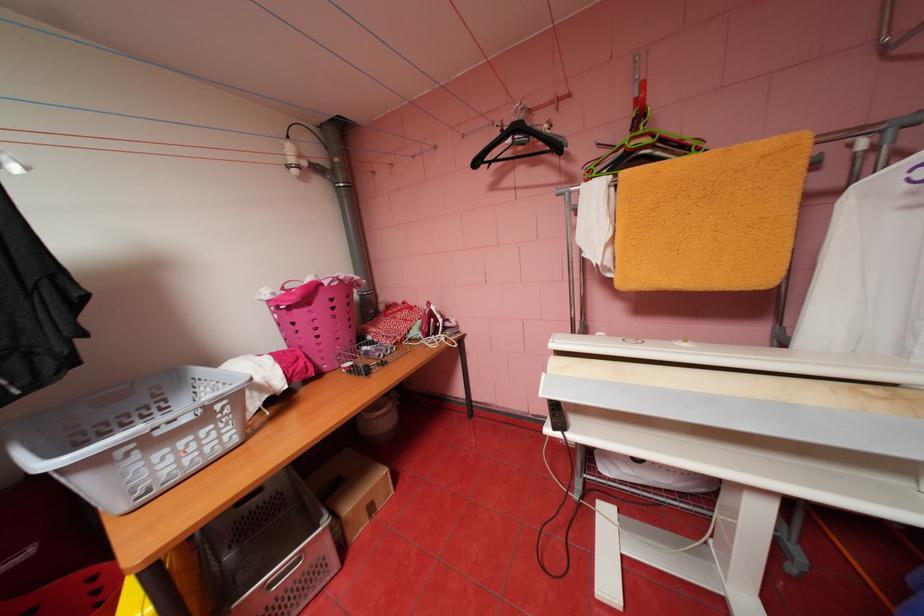
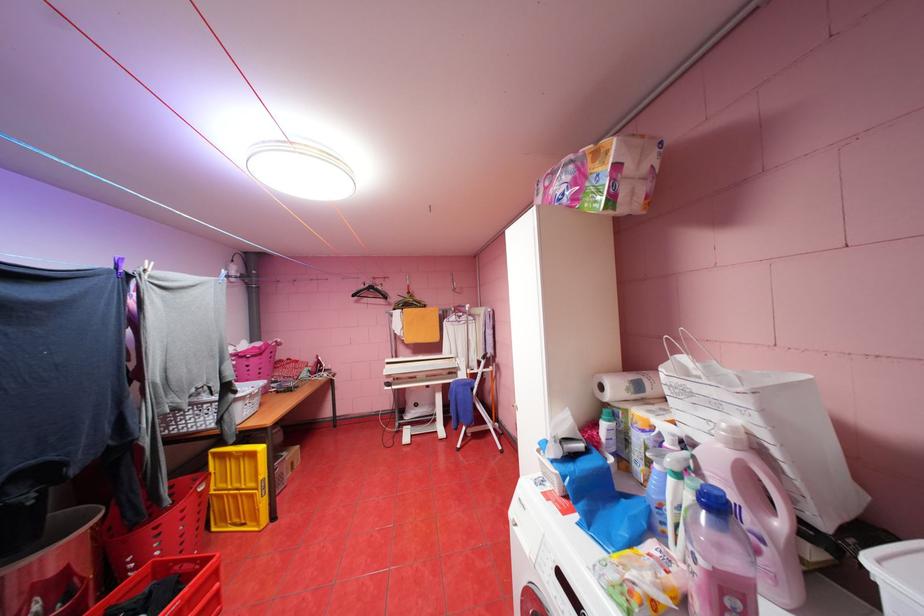
Find the pixel in the second image that matches point (484, 163) in the first image.

(361, 294)